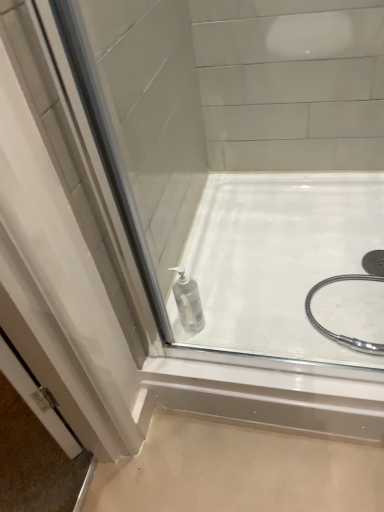
In order to click on transparent plastic bottle at center in this screenshot , I will do `click(277, 263)`.

What is the approximate width of transparent plastic bottle at center?

It is 33.55 inches.

Describe the element at coordinates (277, 263) in the screenshot. I see `transparent plastic bottle at center` at that location.

Describe the element at coordinates (188, 302) in the screenshot. I see `transparent plastic bottle at lower center` at that location.

The width and height of the screenshot is (384, 512). I want to click on transparent plastic bottle at lower center, so click(188, 302).

The image size is (384, 512). Find the location of `transparent plastic bottle at center`. transparent plastic bottle at center is located at coordinates (277, 263).

Considering the relative positions of transparent plastic bottle at lower center and transparent plastic bottle at center in the image provided, is transparent plastic bottle at lower center to the right of transparent plastic bottle at center from the viewer's perspective?

In fact, transparent plastic bottle at lower center is to the left of transparent plastic bottle at center.

Considering the relative positions of transparent plastic bottle at lower center and transparent plastic bottle at center in the image provided, is transparent plastic bottle at lower center behind transparent plastic bottle at center?

Yes.

Which is farther, (183, 328) or (274, 207)?

The point (274, 207) is more distant.

From the image's perspective, which is above, transparent plastic bottle at lower center or transparent plastic bottle at center?

transparent plastic bottle at center is shown above in the image.

From a real-world perspective, is transparent plastic bottle at lower center physically located above or below transparent plastic bottle at center?

transparent plastic bottle at lower center is situated higher than transparent plastic bottle at center in the real world.

Considering the relative sizes of transparent plastic bottle at lower center and transparent plastic bottle at center in the image provided, is transparent plastic bottle at lower center wider than transparent plastic bottle at center?

In fact, transparent plastic bottle at lower center might be narrower than transparent plastic bottle at center.

Does transparent plastic bottle at lower center have a greater height compared to transparent plastic bottle at center?

Correct, transparent plastic bottle at lower center is much taller as transparent plastic bottle at center.

Considering the sizes of objects transparent plastic bottle at lower center and transparent plastic bottle at center in the image provided, who is smaller, transparent plastic bottle at lower center or transparent plastic bottle at center?

transparent plastic bottle at lower center.

Which is correct: transparent plastic bottle at lower center is inside transparent plastic bottle at center, or outside of it?

transparent plastic bottle at lower center lies outside transparent plastic bottle at center.

Are transparent plastic bottle at lower center and transparent plastic bottle at center making contact?

There is a gap between transparent plastic bottle at lower center and transparent plastic bottle at center.

Is transparent plastic bottle at lower center positioned with its back to transparent plastic bottle at center?

No.

Where is `bottle behind the transparent plastic bottle at center`? bottle behind the transparent plastic bottle at center is located at coordinates pos(188,302).

Visually, is transparent plastic bottle at center positioned to the left or to the right of transparent plastic bottle at lower center?

From the image, it's evident that transparent plastic bottle at center is to the right of transparent plastic bottle at lower center.

Which object is further away from the camera taking this photo, transparent plastic bottle at center or transparent plastic bottle at lower center?

transparent plastic bottle at lower center is further from the camera.

Is point (230, 334) positioned in front of point (177, 268)?

That is True.

From the image's perspective, which is above, transparent plastic bottle at center or transparent plastic bottle at lower center?

transparent plastic bottle at center appears higher in the image.

From a real-world perspective, is transparent plastic bottle at center located beneath transparent plastic bottle at lower center?

Yes.

Based on the photo, is transparent plastic bottle at center thinner than transparent plastic bottle at lower center?

No, transparent plastic bottle at center is not thinner than transparent plastic bottle at lower center.

Who is shorter, transparent plastic bottle at center or transparent plastic bottle at lower center?

transparent plastic bottle at center.

Based on their sizes in the image, would you say transparent plastic bottle at center is bigger or smaller than transparent plastic bottle at lower center?

Considering their sizes, transparent plastic bottle at center takes up more space than transparent plastic bottle at lower center.

Would you say transparent plastic bottle at lower center is part of transparent plastic bottle at center's contents?

No, transparent plastic bottle at lower center is located outside of transparent plastic bottle at center.

Is transparent plastic bottle at center touching transparent plastic bottle at lower center?

transparent plastic bottle at center and transparent plastic bottle at lower center are not in contact.

Does transparent plastic bottle at center turn towards transparent plastic bottle at lower center?

No, transparent plastic bottle at center is not oriented towards transparent plastic bottle at lower center.

Identify the location of bottle on the left of transparent plastic bottle at center. (188, 302).

At what (x,y) coordinates should I click in order to perform the action: click on bottle behind the transparent plastic bottle at center. Please return your answer as a coordinate pair (x, y). Looking at the image, I should click on (188, 302).

Locate an element on the screen. bath above the transparent plastic bottle at lower center (from the image's perspective) is located at coordinates (277, 263).